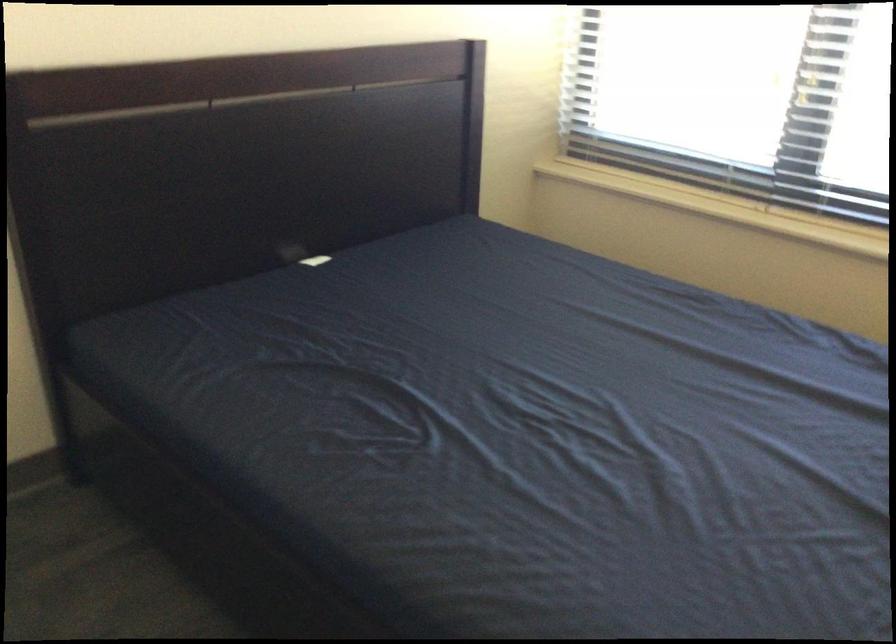
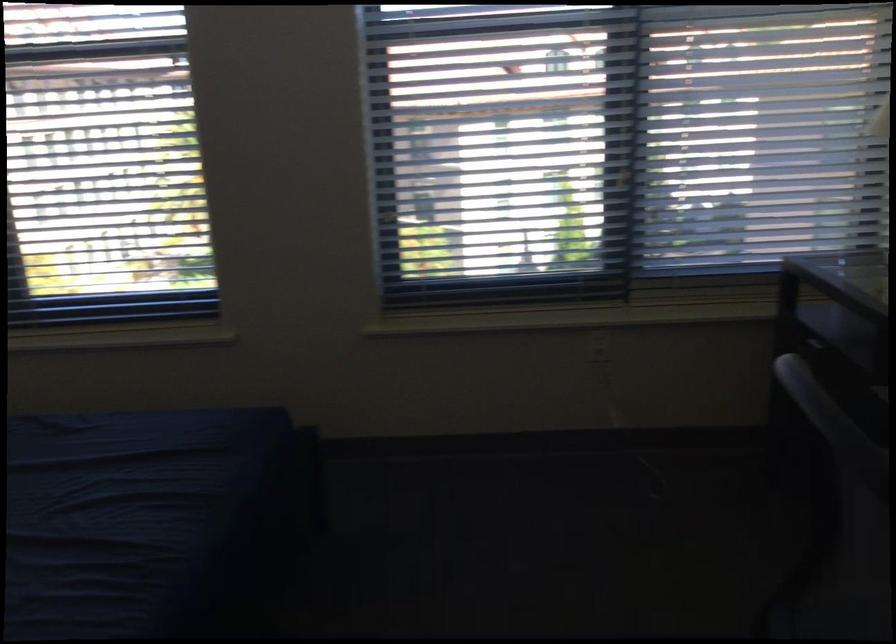
Question: The images are taken continuously from a first-person perspective. In which direction is your viewpoint rotating?

Choices:
 (A) Left
 (B) Right
 (C) Up
 (D) Down

Answer: (B)